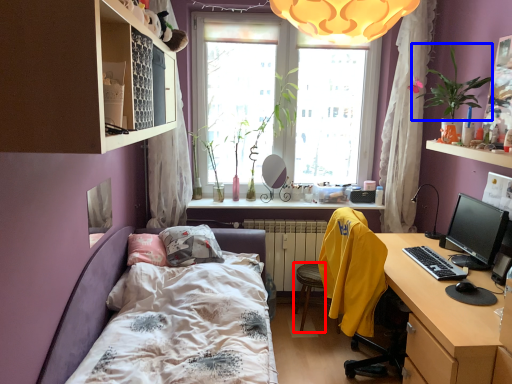
Question: Which object is closer to the camera taking this photo, computer (highlighted by a red box) or plant (highlighted by a blue box)?

Choices:
 (A) computer
 (B) plant

Answer: (B)